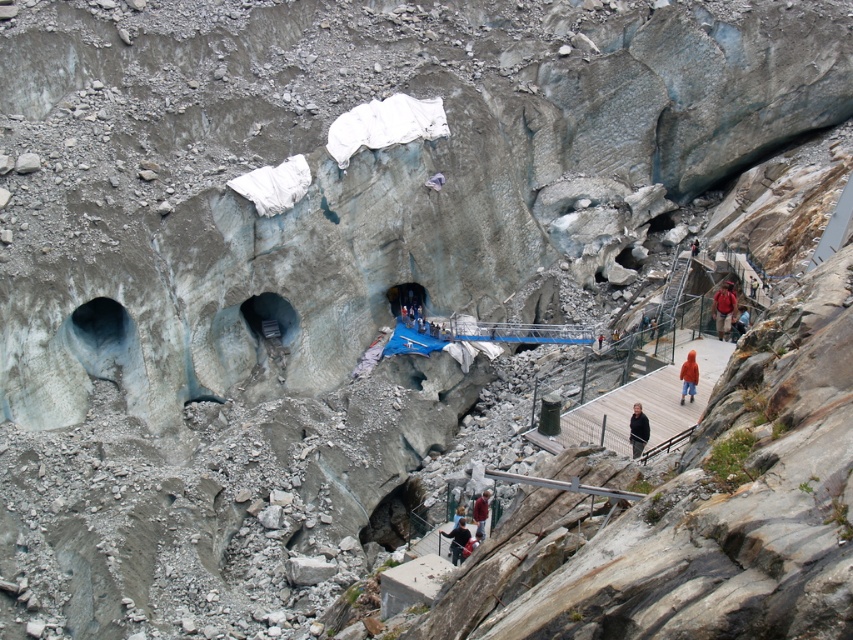
Question: Estimate the real-world distances between objects in this image. Which object is farther from the red fabric jacket at right?

Choices:
 (A) black matte jacket at lower right
 (B) red jacket at right

Answer: (A)

Question: Can you confirm if black matte jacket at lower right is positioned below red woolen sweater at lower center?

Choices:
 (A) no
 (B) yes

Answer: (A)

Question: Can you confirm if red fabric jacket at right is wider than dark blue jacket at lower center?

Choices:
 (A) yes
 (B) no

Answer: (B)

Question: Among these points, which one is farthest from the camera?

Choices:
 (A) (640, 448)
 (B) (456, 547)
 (C) (735, 330)
 (D) (714, 308)

Answer: (D)

Question: In this image, where is dark blue jacket at lower center located relative to red jacket at right?

Choices:
 (A) below
 (B) above

Answer: (A)

Question: Based on their relative distances, which object is farther from the black matte jacket at lower right?

Choices:
 (A) red jacket at right
 (B) red fabric jacket at right
 (C) orange fuzzy jacket at lower right

Answer: (B)